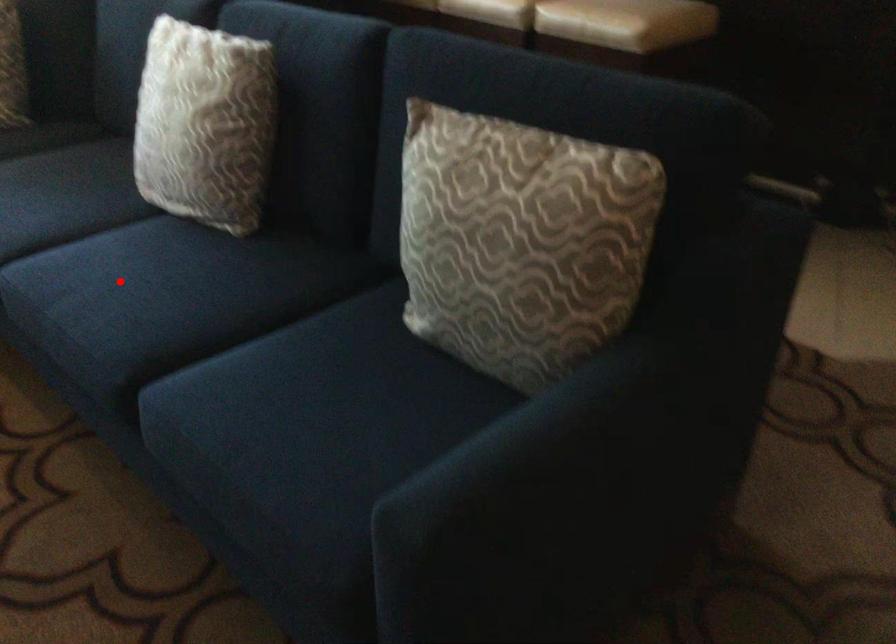
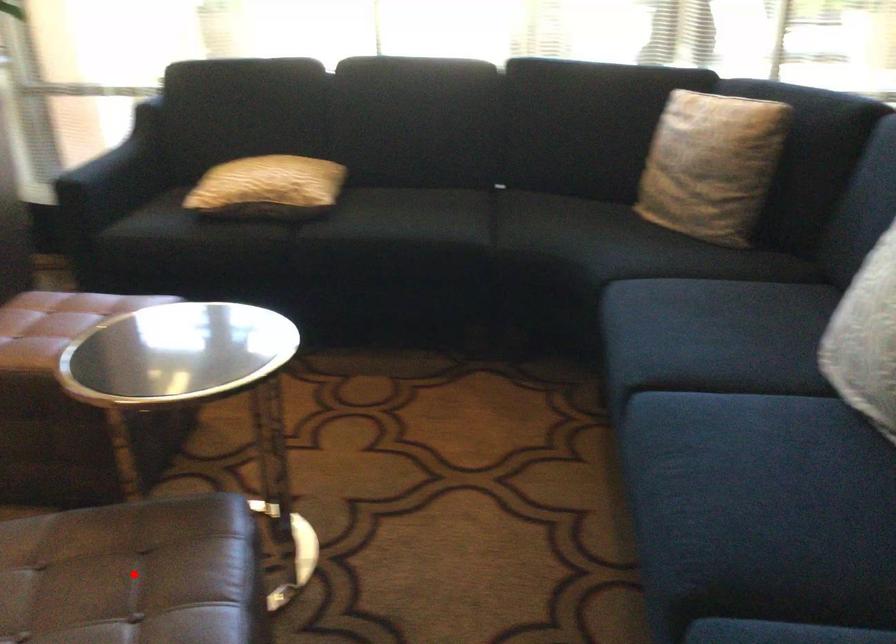
I am providing you with two images of the same scene from different viewpoints. A red point is marked on the first image and another point is marked on the second image. Do the highlighted points in image1 and image2 indicate the same real-world spot?

No